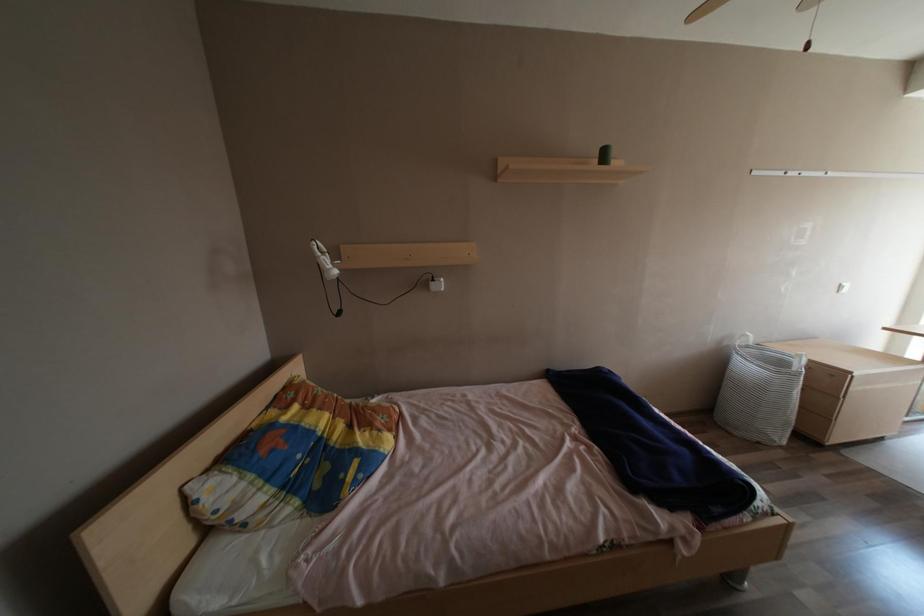
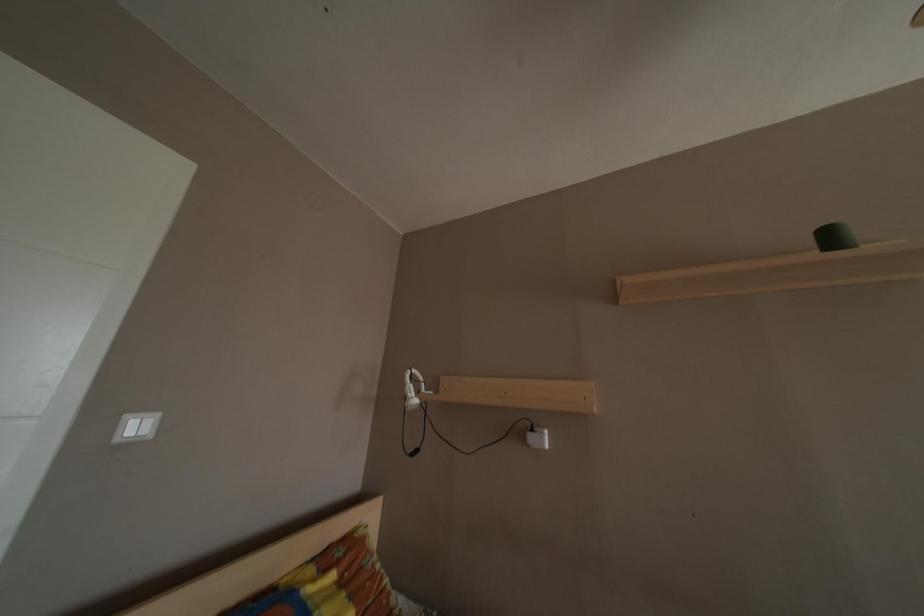
Based on the photo, the images are taken continuously from a first-person perspective. In which direction is your viewpoint rotating?

The rotation direction of the camera is left-up.